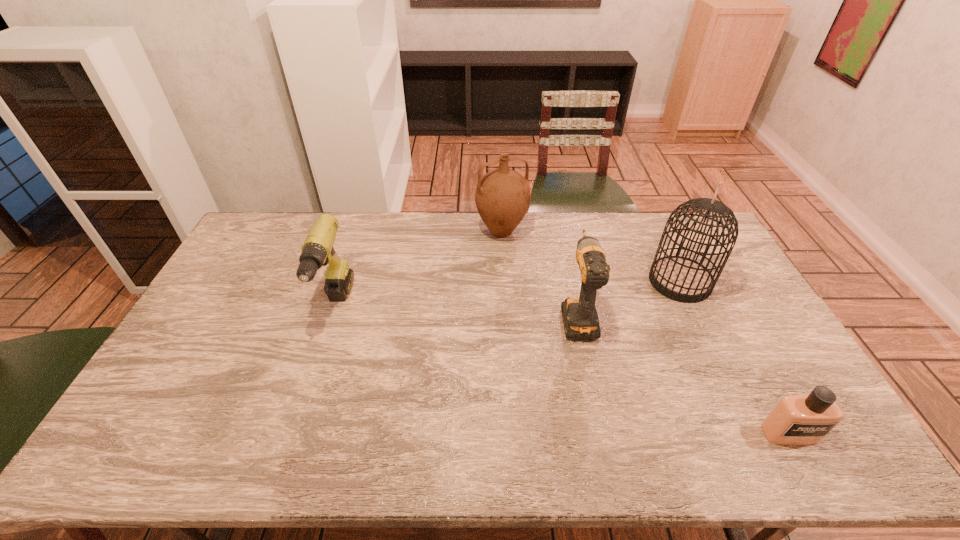
The image size is (960, 540). I want to click on birdcage, so click(x=679, y=278).

The height and width of the screenshot is (540, 960). What are the coordinates of `the fourth object from right to left` in the screenshot? It's located at (502, 197).

The width and height of the screenshot is (960, 540). In order to click on pitcher in this screenshot , I will do `click(502, 197)`.

Where is `the right drill`? This screenshot has width=960, height=540. the right drill is located at coordinates (580, 318).

The image size is (960, 540). Find the location of `the left drill`. the left drill is located at coordinates (317, 251).

Where is `the shortest object`? This screenshot has width=960, height=540. the shortest object is located at coordinates (798, 419).

Where is `perfume`? perfume is located at coordinates (798, 419).

At what (x,y) coordinates should I click in order to perform the action: click on free space located on the left of the tallest object. Please return your answer as a coordinate pair (x, y). This screenshot has height=540, width=960. Looking at the image, I should click on (538, 282).

At what (x,y) coordinates should I click in order to perform the action: click on vacant space located on the left of the pitcher. Please return your answer as a coordinate pair (x, y). Looking at the image, I should click on (436, 232).

Image resolution: width=960 pixels, height=540 pixels. Identify the location of vacant space located with the drill bit of the third object from left to right facing forward. (562, 240).